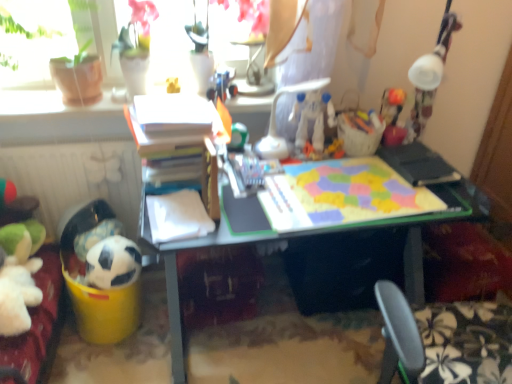
The image size is (512, 384). Find the location of `free space in front of white plastic chair at center`. free space in front of white plastic chair at center is located at coordinates (307, 197).